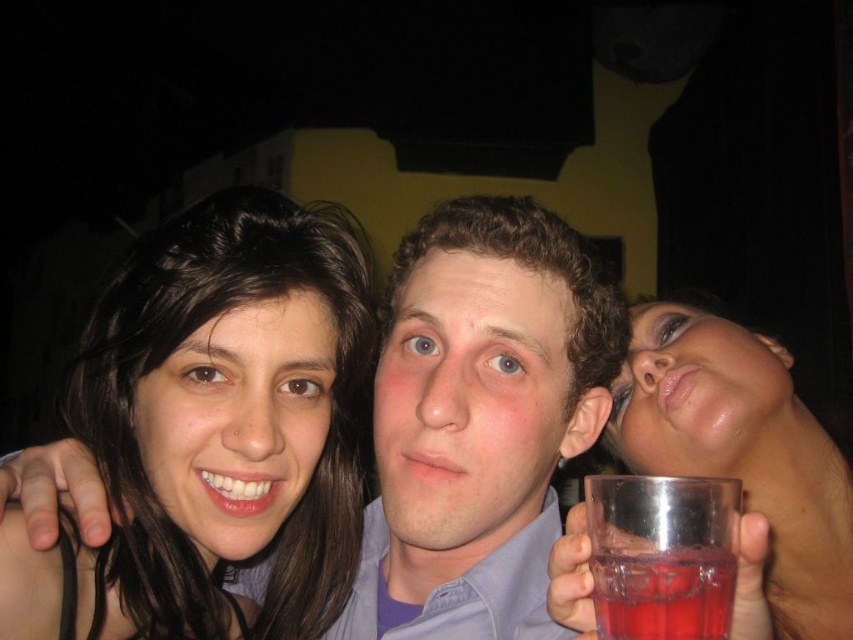
Question: Which of these objects is positioned closest to the transparent plastic glass at upper right?

Choices:
 (A) transparent glass at lower right
 (B) dark brown hair at upper left
 (C) clear plastic glass at center

Answer: (C)

Question: Does clear plastic glass at center lie in front of transparent plastic glass at upper right?

Choices:
 (A) no
 (B) yes

Answer: (B)

Question: Which point is closer to the camera?

Choices:
 (A) transparent glass at lower right
 (B) dark brown hair at upper left
 (C) clear plastic glass at center
 (D) transparent plastic glass at upper right

Answer: (A)

Question: Is clear plastic glass at center to the left of transparent plastic glass at upper right from the viewer's perspective?

Choices:
 (A) yes
 (B) no

Answer: (A)

Question: Does dark brown hair at upper left appear under transparent glass at lower right?

Choices:
 (A) no
 (B) yes

Answer: (A)

Question: Which point is closer to the camera?

Choices:
 (A) transparent glass at lower right
 (B) dark brown hair at upper left
 (C) clear plastic glass at center

Answer: (A)